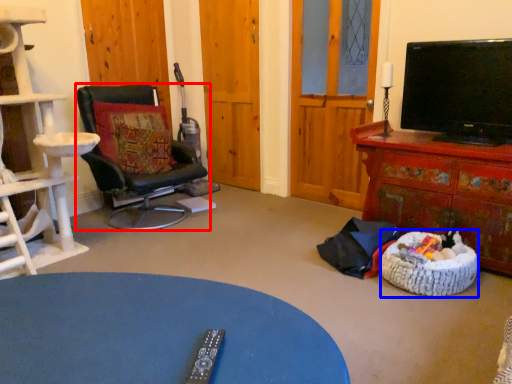
Question: Among these objects, which one is nearest to the camera, chair (highlighted by a red box) or dog bed (highlighted by a blue box)?

Choices:
 (A) chair
 (B) dog bed

Answer: (B)